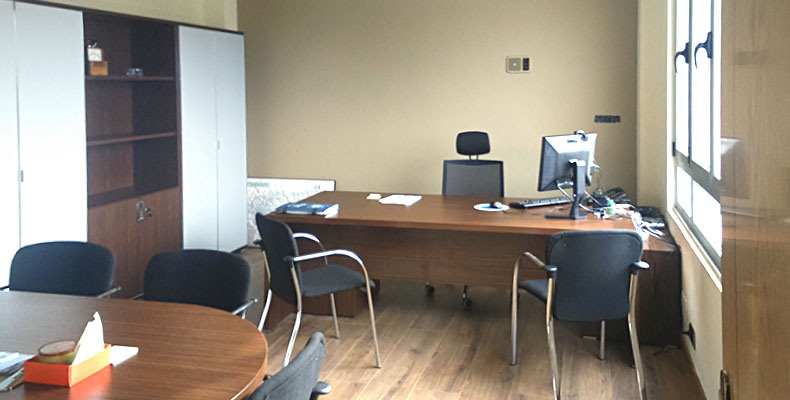
I want to click on wall, so click(427, 52), click(212, 15).